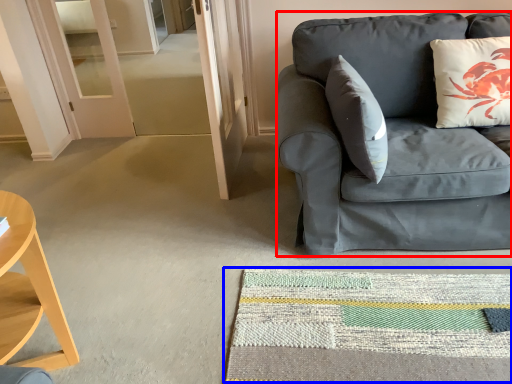
Question: Among these objects, which one is nearest to the camera, studio couch (highlighted by a red box) or mat (highlighted by a blue box)?

Choices:
 (A) studio couch
 (B) mat

Answer: (B)